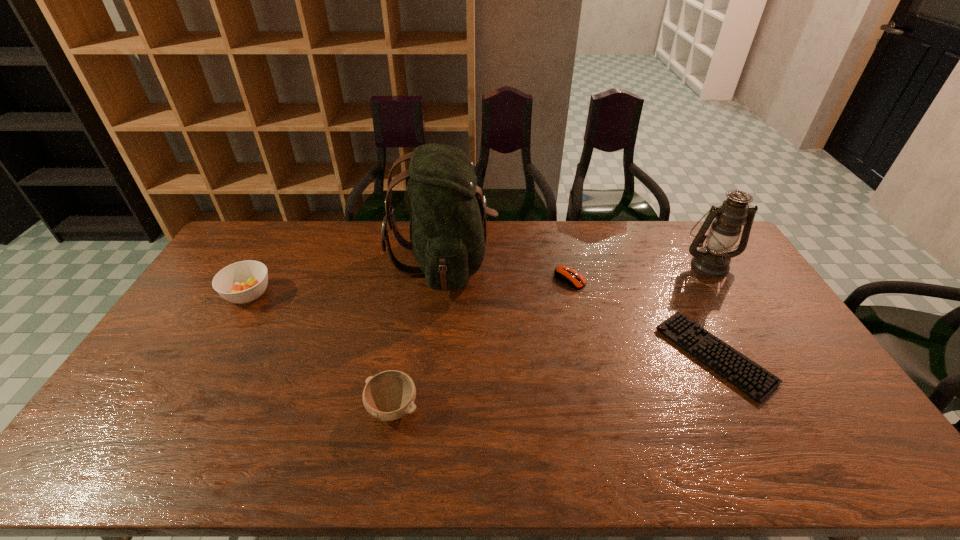
This screenshot has width=960, height=540. What are the coordinates of `vacant space at the near edge` in the screenshot? It's located at (163, 464).

This screenshot has height=540, width=960. I want to click on free location at the near right corner of the desktop, so click(851, 445).

At what (x,y) coordinates should I click in order to perform the action: click on free point between the bowl and the tallest object. Please return your answer as a coordinate pair (x, y). Image resolution: width=960 pixels, height=540 pixels. Looking at the image, I should click on (419, 335).

At what (x,y) coordinates should I click in order to perform the action: click on unoccupied position between the leftmost object and the computer keyboard. Please return your answer as a coordinate pair (x, y). This screenshot has height=540, width=960. Looking at the image, I should click on (481, 325).

I want to click on vacant space that is in between the computer keyboard and the tallest object, so click(579, 308).

Locate an element on the screen. unoccupied position between the bowl and the third object from right to left is located at coordinates (482, 344).

Locate an element on the screen. vacant area that lies between the bowl and the soup bowl is located at coordinates (321, 352).

Where is `vacant space in between the bowl and the backpack`? Image resolution: width=960 pixels, height=540 pixels. vacant space in between the bowl and the backpack is located at coordinates (419, 335).

Where is `free space between the soup bowl and the bowl`? free space between the soup bowl and the bowl is located at coordinates (321, 352).

The height and width of the screenshot is (540, 960). Find the location of `blank region between the shortest object and the bowl`. blank region between the shortest object and the bowl is located at coordinates (554, 382).